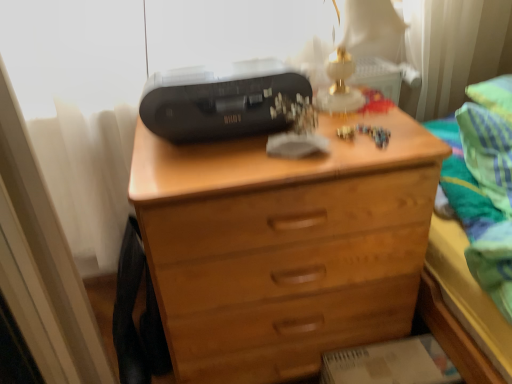
Question: Is black plastic printer at upper center inside the boundaries of green striped fabric at upper right, or outside?

Choices:
 (A) inside
 (B) outside

Answer: (B)

Question: From their relative heights in the image, would you say black plastic printer at upper center is taller or shorter than green striped fabric at upper right?

Choices:
 (A) tall
 (B) short

Answer: (B)

Question: Considering the real-world distances, which object is closest to the green striped fabric at upper right?

Choices:
 (A) black plastic printer at upper center
 (B) wooden chest of drawers at center

Answer: (B)

Question: Based on their relative distances, which object is farther from the green striped fabric at upper right?

Choices:
 (A) wooden chest of drawers at center
 (B) black plastic printer at upper center

Answer: (B)